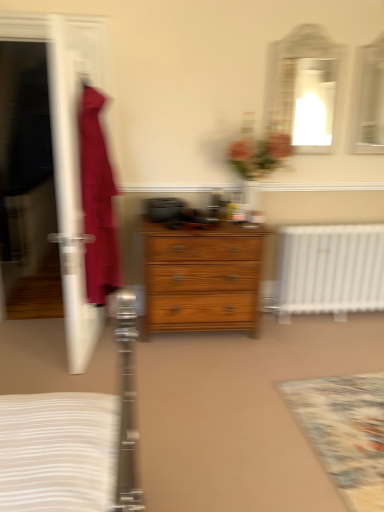
Question: Should I look upward or downward to see matte white mirror at upper right, which appears as the 2th mirror when viewed from the right?

Choices:
 (A) up
 (B) down

Answer: (A)

Question: From a real-world perspective, is matte white mirror at upper right, which appears as the 2th mirror when viewed from the right, physically above floral carpet at lower right?

Choices:
 (A) no
 (B) yes

Answer: (B)

Question: Is matte white mirror at upper right, which appears as the 2th mirror when viewed from the right, next to floral carpet at lower right?

Choices:
 (A) no
 (B) yes

Answer: (A)

Question: Would you say matte white mirror at upper right, which appears as the 2th mirror when viewed from the right, contains floral carpet at lower right?

Choices:
 (A) no
 (B) yes

Answer: (A)

Question: Is matte white mirror at upper right, which is the 1th mirror in left-to-right order, completely or partially outside of floral carpet at lower right?

Choices:
 (A) yes
 (B) no

Answer: (A)

Question: Is matte white mirror at upper right, which is the 1th mirror in left-to-right order, positioned far away from floral carpet at lower right?

Choices:
 (A) no
 (B) yes

Answer: (B)

Question: Can you confirm if matte white mirror at upper right, which is the 1th mirror in left-to-right order, is positioned to the right of floral carpet at lower right?

Choices:
 (A) yes
 (B) no

Answer: (B)

Question: Does wooden chest of drawers at center have a lesser width compared to transparent plastic screen door at left?

Choices:
 (A) no
 (B) yes

Answer: (A)

Question: From the image's perspective, is wooden chest of drawers at center below transparent plastic screen door at left?

Choices:
 (A) no
 (B) yes

Answer: (B)

Question: From a real-world perspective, is wooden chest of drawers at center physically below transparent plastic screen door at left?

Choices:
 (A) no
 (B) yes

Answer: (B)

Question: Does wooden chest of drawers at center lie in front of transparent plastic screen door at left?

Choices:
 (A) yes
 (B) no

Answer: (B)

Question: From a real-world perspective, is wooden chest of drawers at center located higher than transparent plastic screen door at left?

Choices:
 (A) no
 (B) yes

Answer: (A)

Question: Is wooden chest of drawers at center smaller than transparent plastic screen door at left?

Choices:
 (A) no
 (B) yes

Answer: (A)

Question: Is wooden chest of drawers at center beside floral carpet at lower right?

Choices:
 (A) no
 (B) yes

Answer: (A)